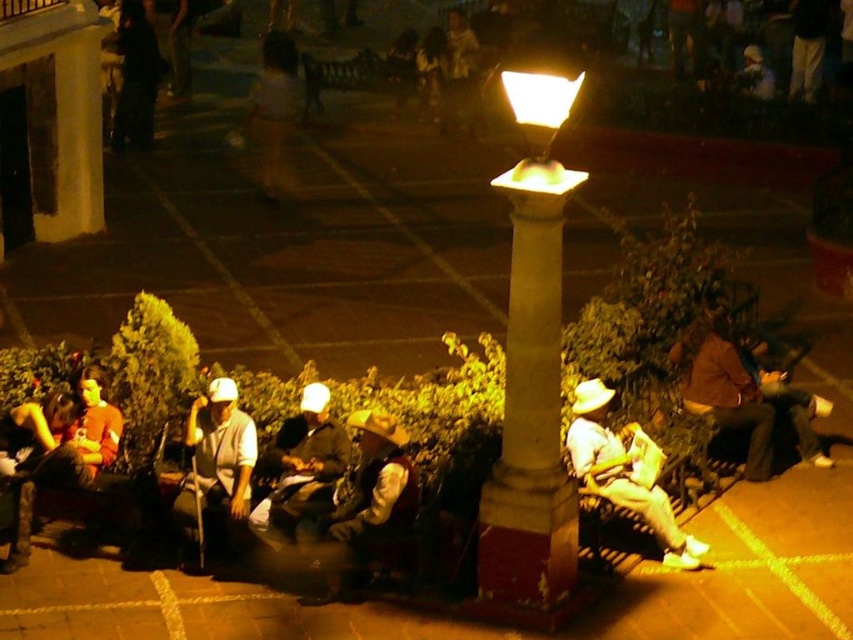
You are a pedestrian trying to walk through the plaza at night. There is a white marble column at center and a camouflage fabric construction worker at center. Which object is closer to you as you enter the plaza?

The white marble column at center is in front of the camouflage fabric construction worker at center, so it is closer to you as you enter the plaza.

You are standing in the plaza and see the white matte hat at center and the brown leather jacket at right. Which object is positioned closer to the left side of the plaza?

The white matte hat at center is positioned to the left of the brown leather jacket at right, so it is closer to the left side of the plaza.